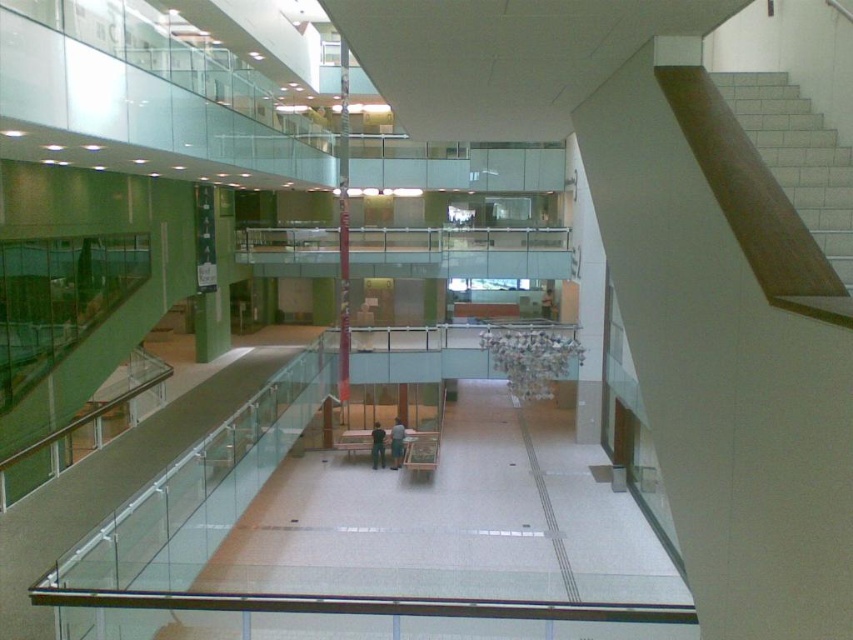
Question: Does clear glass balustrade at center appear over white tile stairs at upper right?

Choices:
 (A) no
 (B) yes

Answer: (B)

Question: Which object appears farthest from the camera in this image?

Choices:
 (A) clear glass balustrade at center
 (B) white tile stairs at upper right

Answer: (A)

Question: Among these objects, which one is nearest to the camera?

Choices:
 (A) white tile stairs at upper right
 (B) clear glass balustrade at center

Answer: (A)

Question: Based on their relative distances, which object is farther from the white tile stairs at upper right?

Choices:
 (A) dark blue jeans at center
 (B) clear glass balustrade at center
 (C) green fabric shirt at center

Answer: (B)

Question: Is white tile stairs at upper right thinner than green fabric shirt at center?

Choices:
 (A) yes
 (B) no

Answer: (B)

Question: Does dark blue jeans at center have a lesser width compared to green fabric shirt at center?

Choices:
 (A) no
 (B) yes

Answer: (A)